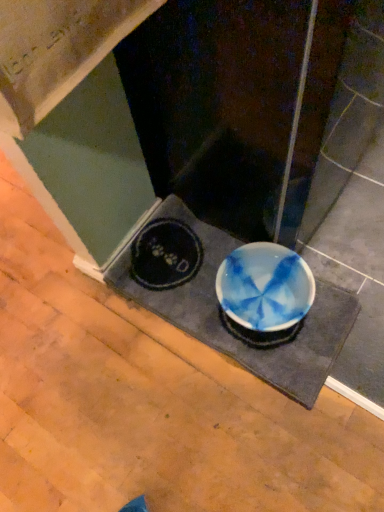
What is the approximate width of blue glossy bowl at center?

blue glossy bowl at center is 13.85 inches in width.

This screenshot has width=384, height=512. What do you see at coordinates (224, 328) in the screenshot?
I see `blue glossy bowl at center` at bounding box center [224, 328].

Find the location of a particular element. The height and width of the screenshot is (512, 384). blue glossy bowl at center is located at coordinates (224, 328).

Where is `blue glossy bowl at center`? The width and height of the screenshot is (384, 512). blue glossy bowl at center is located at coordinates (224, 328).